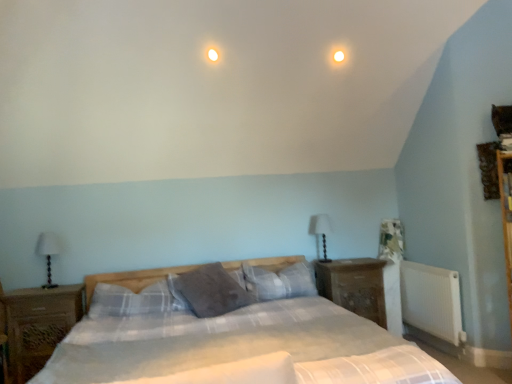
Image resolution: width=512 pixels, height=384 pixels. I want to click on vacant area situated below white fabric lampshade at left, marked as the 2th table lamp in a back-to-front arrangement (from a real-world perspective), so pos(50,289).